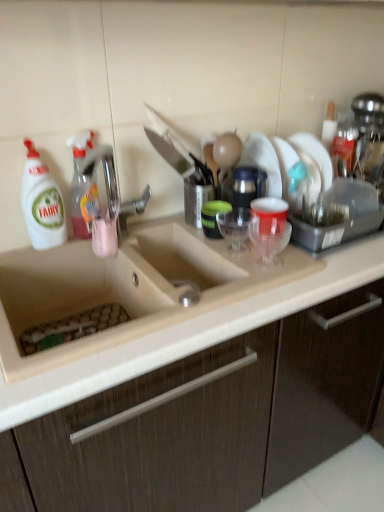
Question: From a real-world perspective, is transparent plastic cup at center, which is the second tableware in left-to-right order, beneath matte wood cabinet at center?

Choices:
 (A) no
 (B) yes

Answer: (A)

Question: Is transparent plastic cup at center, placed as the first tableware when sorted from right to left, thinner than matte wood cabinet at center?

Choices:
 (A) yes
 (B) no

Answer: (A)

Question: Is transparent plastic cup at center, marked as the 1th tableware in a front-to-back arrangement, wider than matte wood cabinet at center?

Choices:
 (A) no
 (B) yes

Answer: (A)

Question: From the image's perspective, does transparent plastic cup at center, acting as the 2th tableware starting from the back, appear lower than matte wood cabinet at center?

Choices:
 (A) no
 (B) yes

Answer: (A)

Question: Is matte wood cabinet at center surrounded by transparent plastic cup at center, placed as the first tableware when sorted from right to left?

Choices:
 (A) no
 (B) yes

Answer: (A)

Question: Can you confirm if transparent plastic cup at center, placed as the first tableware when sorted from right to left, is positioned to the right of matte wood cabinet at center?

Choices:
 (A) yes
 (B) no

Answer: (B)

Question: Is there a large distance between translucent plastic spray bottle at left, which appears as the 2th cleaning product when viewed from the left, and transparent plastic cup at center, which is the second tableware in left-to-right order?

Choices:
 (A) yes
 (B) no

Answer: (B)

Question: Does translucent plastic spray bottle at left, positioned as the first cleaning product in right-to-left order, have a greater height compared to transparent plastic cup at center, marked as the 1th tableware in a front-to-back arrangement?

Choices:
 (A) no
 (B) yes

Answer: (B)

Question: From a real-world perspective, is translucent plastic spray bottle at left, which appears as the 2th cleaning product when viewed from the left, physically below transparent plastic cup at center, marked as the 1th tableware in a front-to-back arrangement?

Choices:
 (A) yes
 (B) no

Answer: (B)

Question: Is translucent plastic spray bottle at left, positioned as the first cleaning product in right-to-left order, not inside transparent plastic cup at center, which is the second tableware in left-to-right order?

Choices:
 (A) yes
 (B) no

Answer: (A)

Question: Can you confirm if translucent plastic spray bottle at left, positioned as the first cleaning product in right-to-left order, is wider than transparent plastic cup at center, which is the second tableware in left-to-right order?

Choices:
 (A) yes
 (B) no

Answer: (B)

Question: Can you confirm if translucent plastic spray bottle at left, which appears as the 2th cleaning product when viewed from the left, is shorter than transparent plastic cup at center, placed as the first tableware when sorted from right to left?

Choices:
 (A) no
 (B) yes

Answer: (A)

Question: From a real-world perspective, is translucent plastic cup at sink, acting as the second tableware starting from the front, on top of translucent plastic spray bottle at left, which appears as the 2th cleaning product when viewed from the left?

Choices:
 (A) yes
 (B) no

Answer: (B)